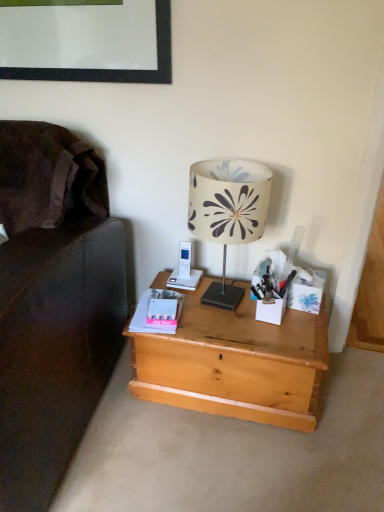
Where is `empty space that is ontop of matte pink paperback book at center-left`? empty space that is ontop of matte pink paperback book at center-left is located at coordinates (168, 312).